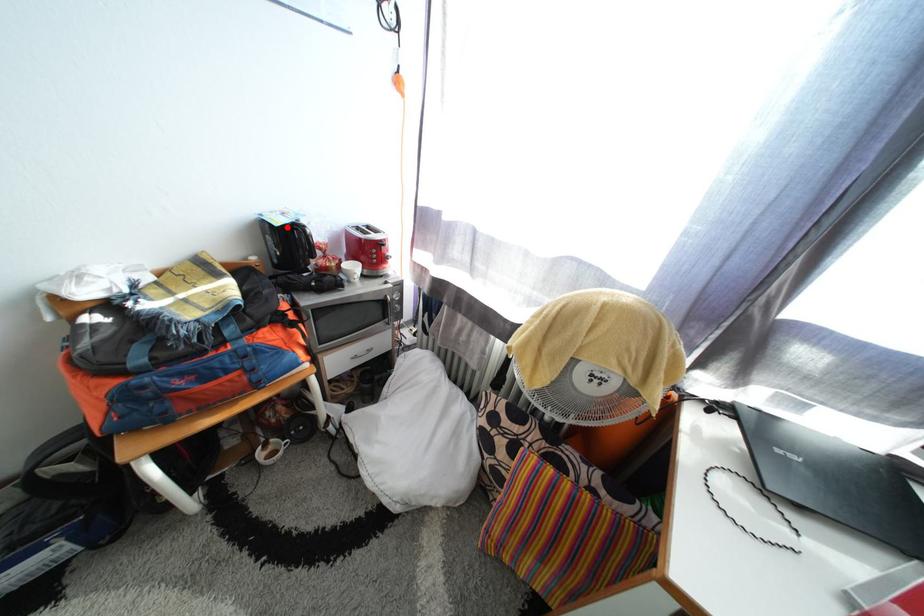
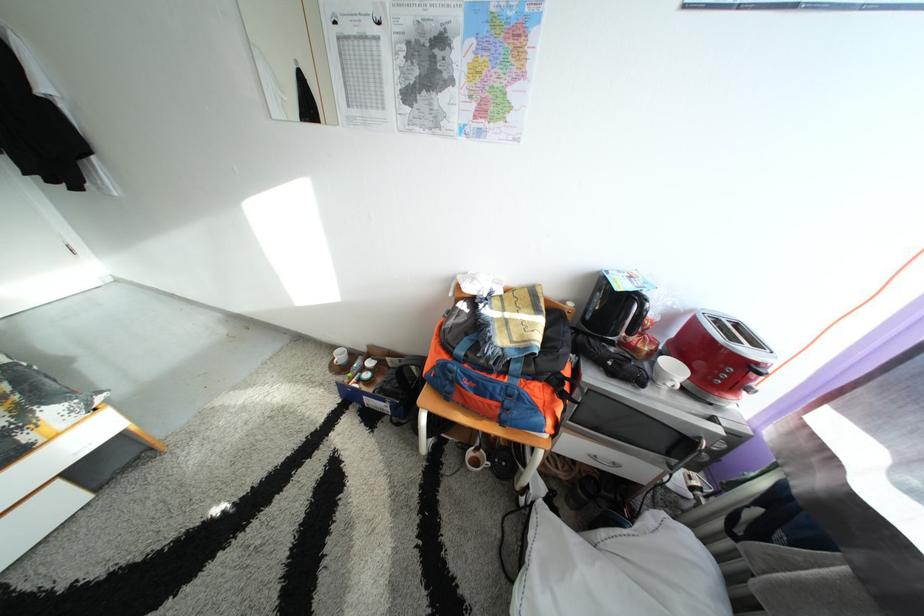
Locate, in the second image, the point that corresponds to the highlighted location in the first image.

(630, 292)